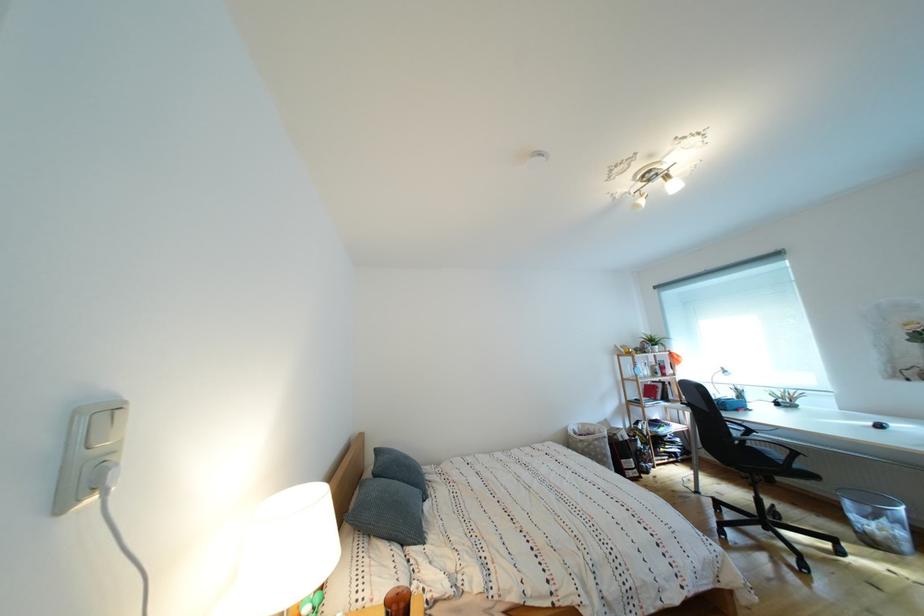
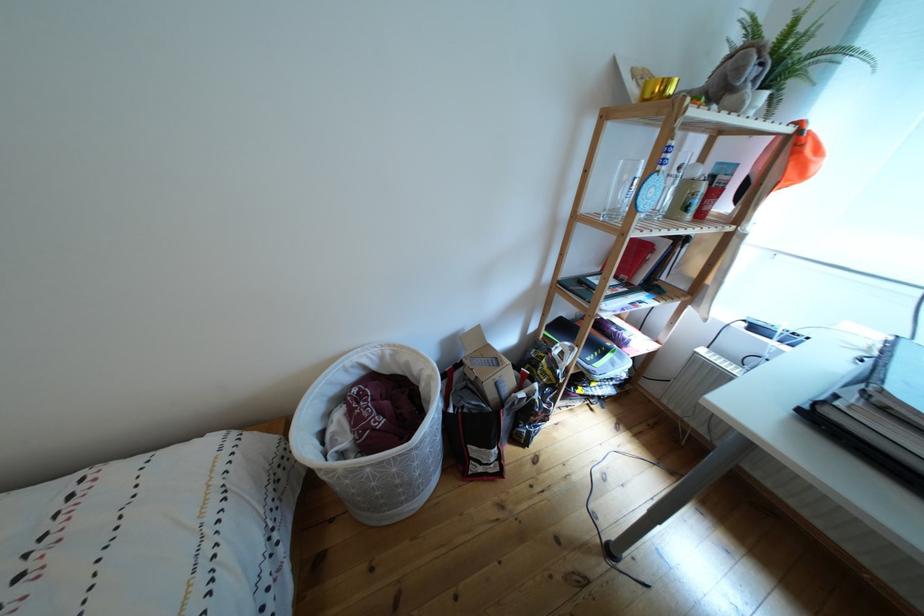
Where in the second image is the point corresponding to (x=658, y=352) from the first image?

(762, 77)